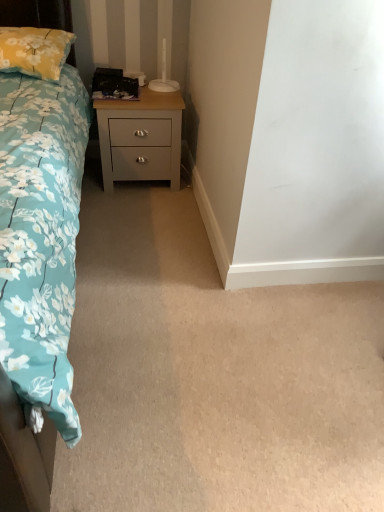
Question: Is blue floral fabric bed at left thinner than satin gray wood nightstand at center?

Choices:
 (A) yes
 (B) no

Answer: (B)

Question: From a real-world perspective, is blue floral fabric bed at left under satin gray wood nightstand at center?

Choices:
 (A) no
 (B) yes

Answer: (A)

Question: Would you say satin gray wood nightstand at center is part of blue floral fabric bed at left's contents?

Choices:
 (A) no
 (B) yes

Answer: (A)

Question: Can you confirm if blue floral fabric bed at left is bigger than satin gray wood nightstand at center?

Choices:
 (A) yes
 (B) no

Answer: (A)

Question: Considering the relative sizes of blue floral fabric bed at left and satin gray wood nightstand at center in the image provided, is blue floral fabric bed at left shorter than satin gray wood nightstand at center?

Choices:
 (A) no
 (B) yes

Answer: (A)

Question: Are blue floral fabric bed at left and satin gray wood nightstand at center making contact?

Choices:
 (A) no
 (B) yes

Answer: (A)

Question: Is yellow floral pillow at upper left positioned beyond the bounds of blue floral fabric bed at left?

Choices:
 (A) yes
 (B) no

Answer: (B)

Question: Does yellow floral pillow at upper left have a larger size compared to blue floral fabric bed at left?

Choices:
 (A) yes
 (B) no

Answer: (B)

Question: Can blue floral fabric bed at left be found inside yellow floral pillow at upper left?

Choices:
 (A) yes
 (B) no

Answer: (B)

Question: Is yellow floral pillow at upper left positioned with its back to blue floral fabric bed at left?

Choices:
 (A) yes
 (B) no

Answer: (A)

Question: Is yellow floral pillow at upper left at the left side of blue floral fabric bed at left?

Choices:
 (A) yes
 (B) no

Answer: (A)

Question: From the image's perspective, is yellow floral pillow at upper left on top of blue floral fabric bed at left?

Choices:
 (A) no
 (B) yes

Answer: (B)

Question: Is yellow floral pillow at upper left wider than satin gray wood nightstand at center?

Choices:
 (A) no
 (B) yes

Answer: (B)